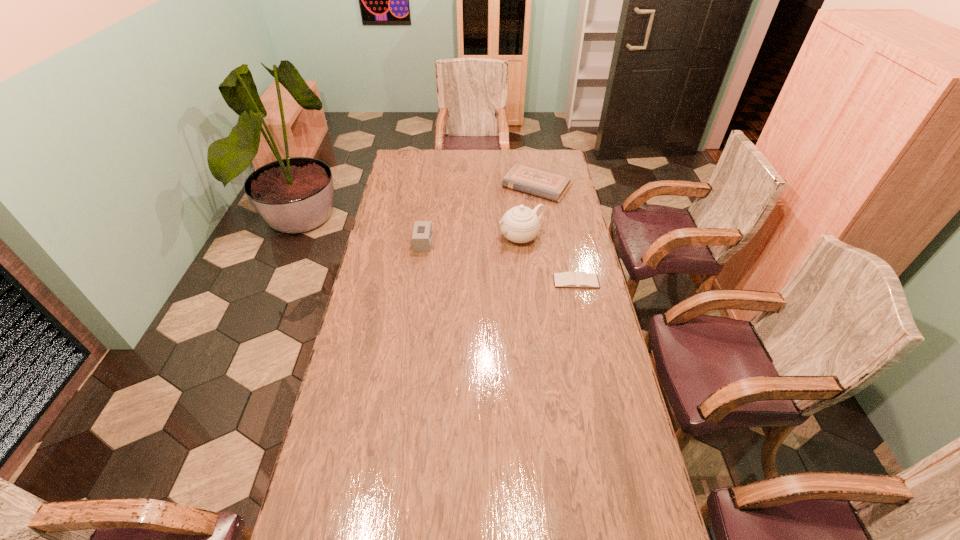
Identify the location of vacant space located 0.140m on the front of the shortest object. (584, 316).

The image size is (960, 540). I want to click on vacant region located 0.300m on the spine side of the Bible, so click(494, 238).

Locate an element on the screen. The image size is (960, 540). vacant space located 0.230m on the spine side of the Bible is located at coordinates (501, 229).

Find the location of a particular element. This screenshot has width=960, height=540. vacant space situated on the spine side of the Bible is located at coordinates (496, 235).

The image size is (960, 540). Identify the location of vacant position located on the spout of the chinaware. (459, 264).

The image size is (960, 540). I want to click on vacant area situated on the spout of the chinaware, so click(455, 265).

Locate an element on the screen. The width and height of the screenshot is (960, 540). vacant space situated 0.330m on the spout of the chinaware is located at coordinates (436, 274).

You are a GUI agent. You are given a task and a screenshot of the screen. Output one action in this format:
    pyautogui.click(x=<x>, y=<y>)
    Task: Click on the object that is at the far edge
    The image size is (960, 540).
    Given the screenshot: What is the action you would take?
    pyautogui.click(x=537, y=181)

Where is `diary at the right edge`? diary at the right edge is located at coordinates (569, 279).

At what (x,y) coordinates should I click in order to perform the action: click on Bible positioned at the right edge. Please return your answer as a coordinate pair (x, y). The image size is (960, 540). Looking at the image, I should click on (537, 181).